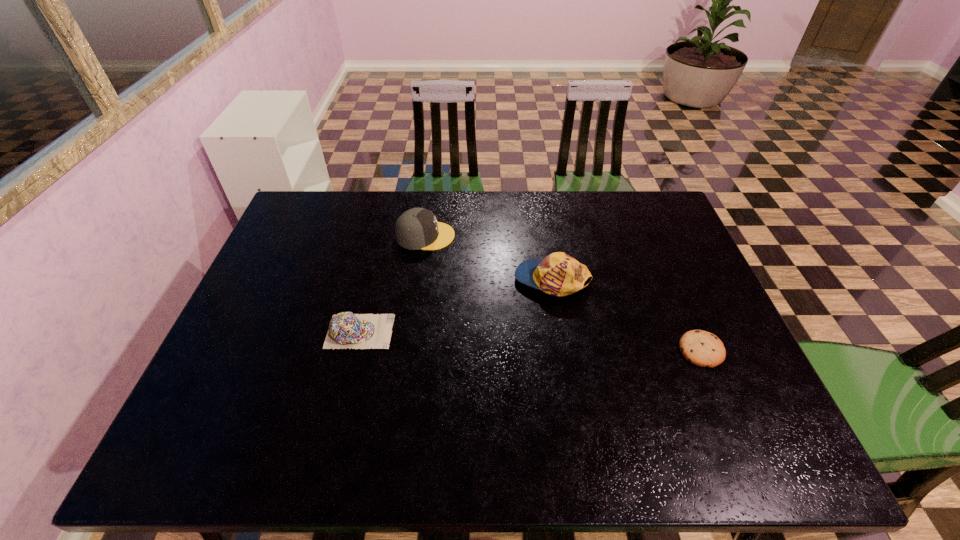
Locate an element on the screen. The width and height of the screenshot is (960, 540). object that ranks as the third closest to the second object from right to left is located at coordinates (346, 330).

You are a GUI agent. You are given a task and a screenshot of the screen. Output one action in this format:
    pyautogui.click(x=<x>, y=<y>)
    Task: Click on the object that stands as the third closest to the third tallest object
    
    Given the screenshot: What is the action you would take?
    pyautogui.click(x=701, y=348)

Locate an element on the screen. cap that is the second closest to the farthest cap is located at coordinates (346, 330).

Point out which cap is positioned as the nearest to the second shortest object. Please provide its 2D coordinates. Your answer should be formatted as a tuple, i.e. [(x, y)], where the tuple contains the x and y coordinates of a point satisfying the conditions above.

[(417, 228)]

This screenshot has width=960, height=540. In order to click on free spot that satisfies the following two spatial constraints: 1. on the back side of the cookie; 2. on the bill of the third nearest object in this screenshot , I will do `click(671, 280)`.

This screenshot has height=540, width=960. Identify the location of free location that satisfies the following two spatial constraints: 1. on the bill of the second nearest cap; 2. on the right side of the rightmost object. (564, 350).

You are a GUI agent. You are given a task and a screenshot of the screen. Output one action in this format:
    pyautogui.click(x=<x>, y=<y>)
    Task: Click on the vacant region that satisfies the following two spatial constraints: 1. on the front, side, and top of the nearest cap; 2. on the right side of the rightmost object
    
    Given the screenshot: What is the action you would take?
    pyautogui.click(x=355, y=350)

Where is `vacant space that satisfies the following two spatial constraints: 1. on the bill of the shortest object; 2. on the left side of the second farthest object`? This screenshot has width=960, height=540. vacant space that satisfies the following two spatial constraints: 1. on the bill of the shortest object; 2. on the left side of the second farthest object is located at coordinates (564, 350).

The height and width of the screenshot is (540, 960). In order to click on vacant area that satisfies the following two spatial constraints: 1. on the front-facing side of the farthest object; 2. on the back side of the cookie in this screenshot , I will do `click(410, 350)`.

At what (x,y) coordinates should I click in order to perform the action: click on vacant space that satisfies the following two spatial constraints: 1. on the bill of the second farthest object; 2. on the left side of the cookie. Please return your answer as a coordinate pair (x, y). The width and height of the screenshot is (960, 540). Looking at the image, I should click on (564, 350).